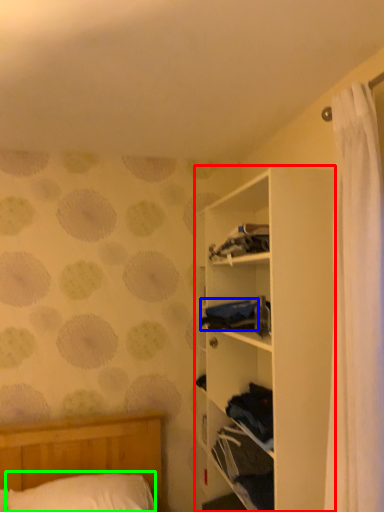
Question: Estimate the real-world distances between objects in this image. Which object is closer to shelf (highlighted by a red box), clothing (highlighted by a blue box) or pillow (highlighted by a green box)?

Choices:
 (A) clothing
 (B) pillow

Answer: (A)